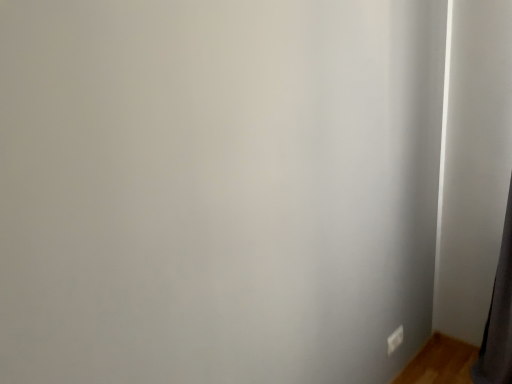
Measure the distance between white plastic electric outlet at lower right and camera.

white plastic electric outlet at lower right is 6.48 feet away from camera.

This screenshot has height=384, width=512. What do you see at coordinates (395, 340) in the screenshot?
I see `white plastic electric outlet at lower right` at bounding box center [395, 340].

Find the location of `white plastic electric outlet at lower right`. white plastic electric outlet at lower right is located at coordinates (395, 340).

Find the location of a particular element. white plastic electric outlet at lower right is located at coordinates (395, 340).